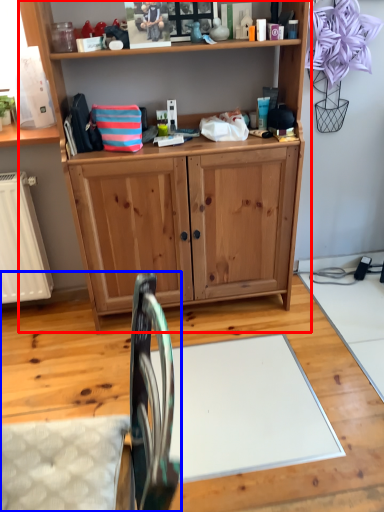
Question: Among these objects, which one is nearest to the camera, vanity (highlighted by a red box) or swivel chair (highlighted by a blue box)?

Choices:
 (A) vanity
 (B) swivel chair

Answer: (B)